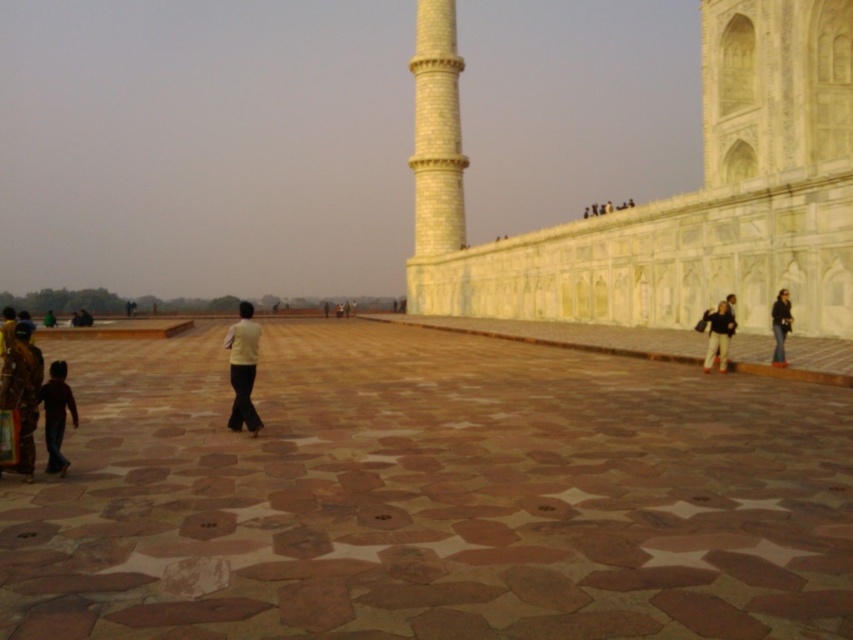
Question: Is white matte pants at center to the left of green fabric person at lower left from the viewer's perspective?

Choices:
 (A) yes
 (B) no

Answer: (B)

Question: Which point is farther to the camera?

Choices:
 (A) (61, 378)
 (B) (790, 328)
 (C) (508, 408)

Answer: (B)

Question: Which object is the farthest from the dark brown leather pants at lower left?

Choices:
 (A) green fabric person at lower left
 (B) light brown leather jacket at lower right
 (C) white matte pants at center
 (D) white marble wall at upper right

Answer: (D)

Question: Is brown stone plaza at center positioned before white matte pants at center?

Choices:
 (A) no
 (B) yes

Answer: (B)

Question: In this image, where is white marble wall at upper right located relative to dark brown leather pants at lower left?

Choices:
 (A) left
 (B) right

Answer: (B)

Question: Which is farther from the brown stone plaza at center?

Choices:
 (A) light brown leather jacket at lower right
 (B) denim pants at right

Answer: (B)